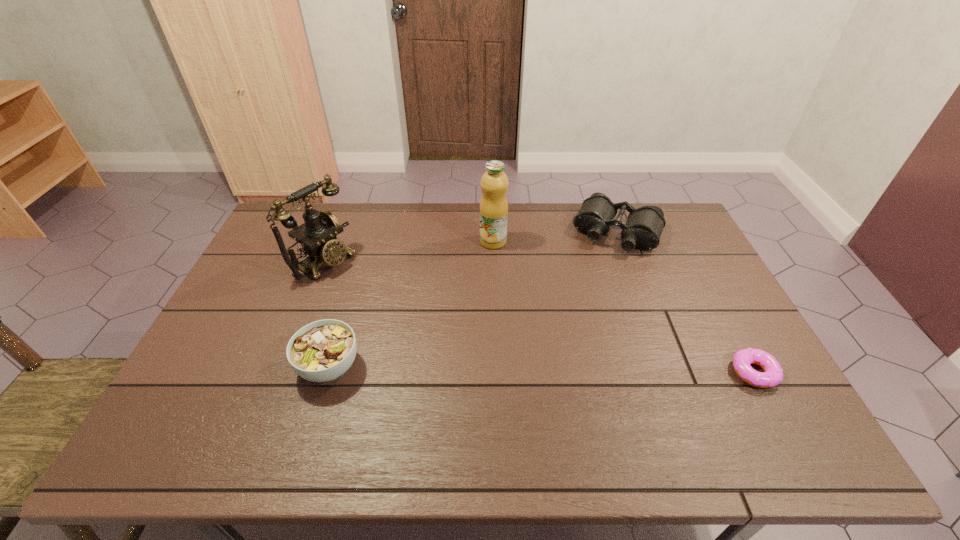
The width and height of the screenshot is (960, 540). Identify the location of vacant space on the desktop that is between the soup bowl and the doughnut and is positioned through the eyepieces of the binoculars. click(x=555, y=370).

The height and width of the screenshot is (540, 960). What are the coordinates of `vacant spot on the desktop that is between the soup bowl and the shortest object and is positioned on the front label of the fruit juice` in the screenshot? It's located at (577, 370).

In order to click on free space on the desktop that is between the soup bowl and the shortest object and is positioned on the rotary dial of the telephone in this screenshot , I will do `click(492, 369)`.